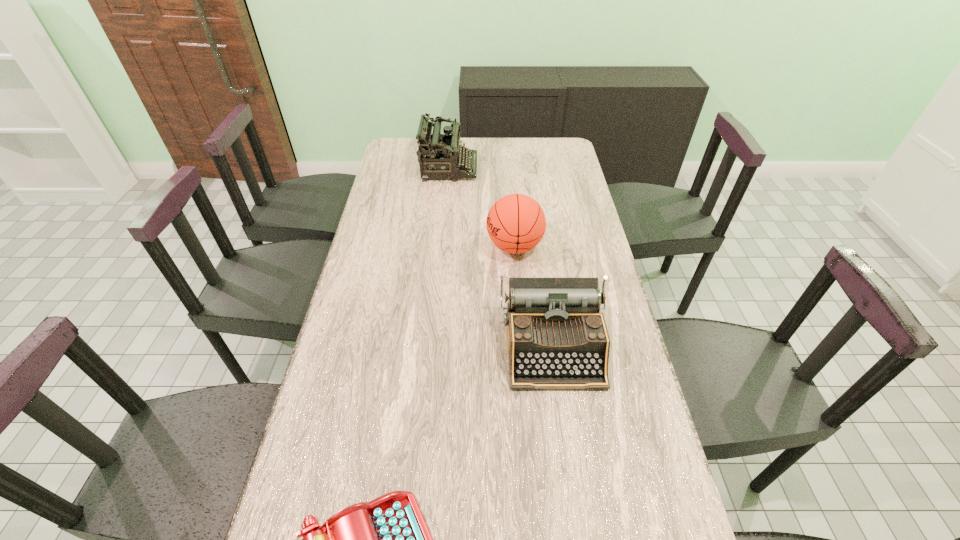
You are a GUI agent. You are given a task and a screenshot of the screen. Output one action in this format:
    pyautogui.click(x=<x>, y=<y>)
    Task: Click on the vacant area between the basketball and the farthest object
    Image resolution: width=960 pixels, height=540 pixels.
    Given the screenshot: What is the action you would take?
    pyautogui.click(x=482, y=207)

Point out which object is positioned as the third nearest to the third farthest object. Please provide its 2D coordinates. Your answer should be formatted as a tuple, i.e. [(x, y)], where the tuple contains the x and y coordinates of a point satisfying the conditions above.

[(444, 154)]

Identify which object is located as the third nearest to the nearest typewriter. Please provide its 2D coordinates. Your answer should be formatted as a tuple, i.e. [(x, y)], where the tuple contains the x and y coordinates of a point satisfying the conditions above.

[(444, 154)]

Locate which typewriter ranks in proximity to the farthest typewriter. Please provide its 2D coordinates. Your answer should be formatted as a tuple, i.e. [(x, y)], where the tuple contains the x and y coordinates of a point satisfying the conditions above.

[(557, 338)]

Locate which typewriter ranks second in proximity to the second nearest object. Please provide its 2D coordinates. Your answer should be formatted as a tuple, i.e. [(x, y)], where the tuple contains the x and y coordinates of a point satisfying the conditions above.

[(444, 154)]